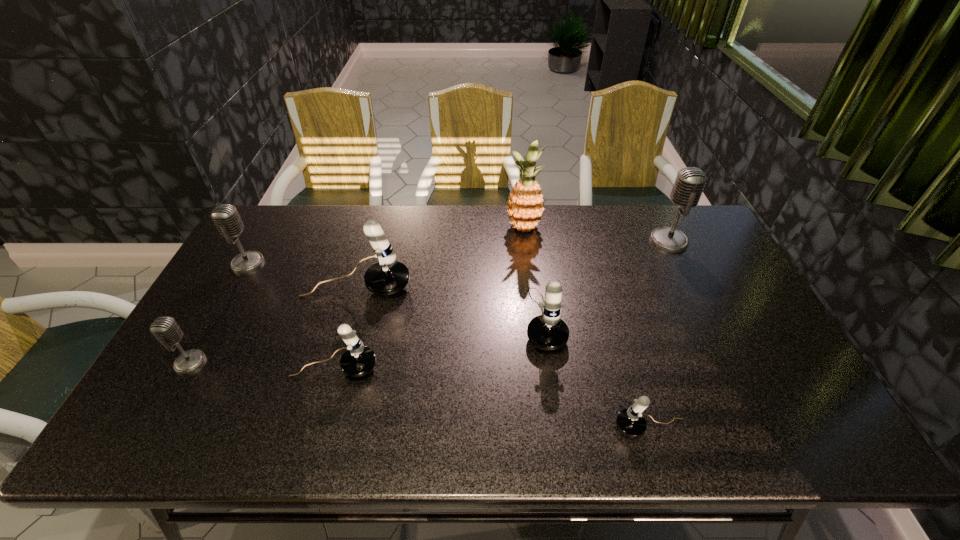
Where is `the shortest microphone`? the shortest microphone is located at coordinates (630, 422).

The width and height of the screenshot is (960, 540). Find the location of `free region located 0.330m on the right of the pineapple`. free region located 0.330m on the right of the pineapple is located at coordinates (637, 228).

Find the location of a particular element. The width and height of the screenshot is (960, 540). free space located 0.380m on the left of the farthest gray microphone is located at coordinates (538, 241).

The width and height of the screenshot is (960, 540). Identify the location of free space located 0.280m on the right of the biggest white microphone. (504, 287).

What are the coordinates of `vacant region located 0.130m on the front of the second biggest gray microphone` in the screenshot? It's located at (225, 305).

Locate an element on the screen. The height and width of the screenshot is (540, 960). blank area located 0.110m on the left of the fifth microphone from left to right is located at coordinates (485, 318).

Where is `vacant space located 0.080m on the back of the second smallest white microphone`? vacant space located 0.080m on the back of the second smallest white microphone is located at coordinates (346, 329).

Where is `free region located 0.150m on the back of the nearest gray microphone`? This screenshot has height=540, width=960. free region located 0.150m on the back of the nearest gray microphone is located at coordinates (221, 308).

Locate an element on the screen. Image resolution: width=960 pixels, height=540 pixels. vacant space located 0.270m on the left of the nearest object is located at coordinates (496, 427).

Where is `pineapple situated at the far edge`? The width and height of the screenshot is (960, 540). pineapple situated at the far edge is located at coordinates (525, 207).